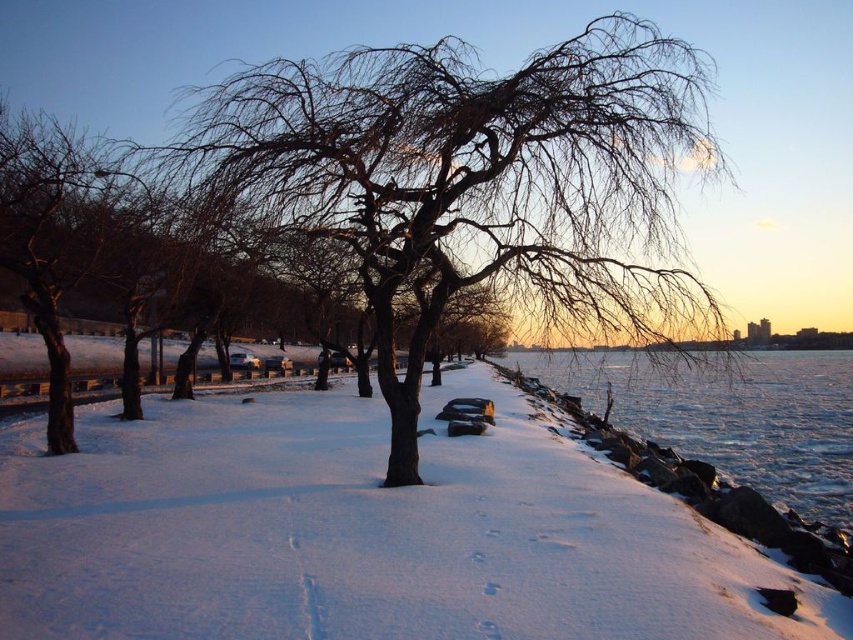
Question: Which point is farther to the camera?

Choices:
 (A) (616, 372)
 (B) (624, 600)
 (C) (206, 179)

Answer: (A)

Question: Can you confirm if white powdery snow at center is smaller than frozen ice at lower right?

Choices:
 (A) yes
 (B) no

Answer: (A)

Question: Can you confirm if white powdery snow at center is smaller than bare branches at center?

Choices:
 (A) yes
 (B) no

Answer: (A)

Question: Which point appears farthest from the camera in this image?

Choices:
 (A) (601, 330)
 (B) (515, 636)

Answer: (A)

Question: Is bare branches at center further to camera compared to frozen ice at lower right?

Choices:
 (A) no
 (B) yes

Answer: (A)

Question: Which of the following is the closest to the observer?

Choices:
 (A) white powdery snow at center
 (B) bare branches at center

Answer: (A)